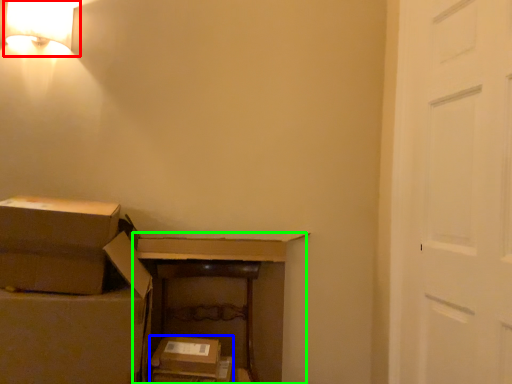
Question: Which is farther away from lamp (highlighted by a red box)? storage box (highlighted by a blue box) or dresser (highlighted by a green box)?

Choices:
 (A) storage box
 (B) dresser

Answer: (A)